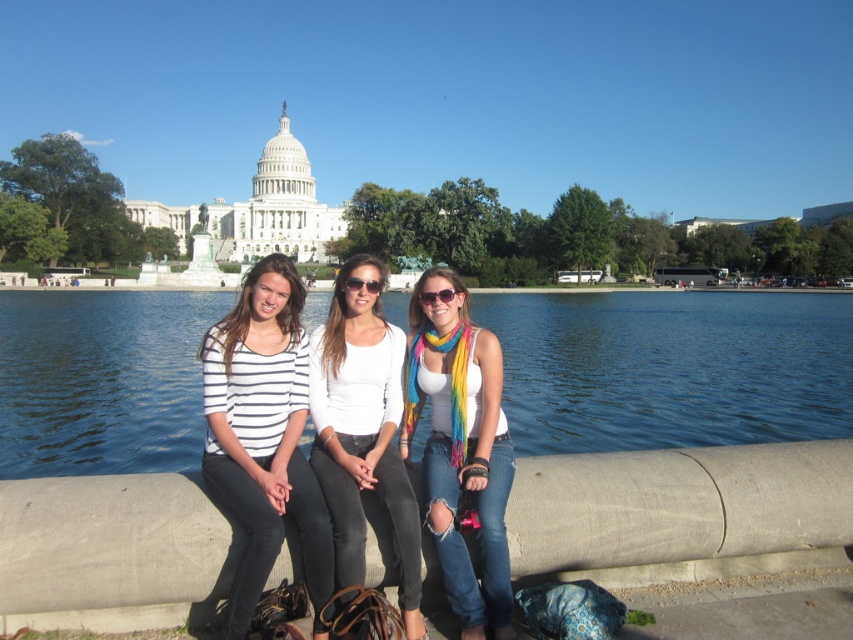
Question: Considering the real-world distances, which object is closest to the white matte shirt at center?

Choices:
 (A) rainbow fabric scarf at center
 (B) rainbow scarf at center

Answer: (B)

Question: Is rainbow scarf at center positioned at the back of sunglasses at center?

Choices:
 (A) no
 (B) yes

Answer: (A)

Question: Can you confirm if blue water at center is bigger than white striped shirt at center?

Choices:
 (A) no
 (B) yes

Answer: (B)

Question: Among these objects, which one is nearest to the camera?

Choices:
 (A) sunglasses at center
 (B) white matte shirt at center
 (C) blue water at center
 (D) rainbow fabric scarf at center

Answer: (B)

Question: Does rainbow scarf at center have a larger size compared to white matte shirt at center?

Choices:
 (A) no
 (B) yes

Answer: (B)

Question: Among these objects, which one is farthest from the camera?

Choices:
 (A) blue water at center
 (B) rainbow scarf at center

Answer: (A)